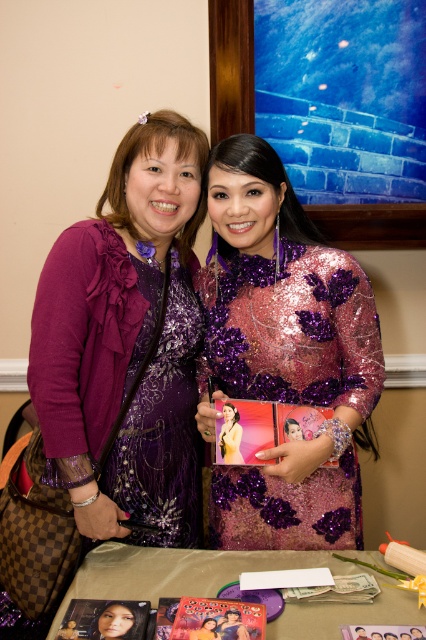
Question: Is purple sequined dress at center further to camera compared to metallic gold photo frame at center?

Choices:
 (A) yes
 (B) no

Answer: (A)

Question: Among these objects, which one is nearest to the camera?

Choices:
 (A) metallic gold table at lower center
 (B) sequined purple dress at center

Answer: (A)

Question: Which point is farther to the camera?

Choices:
 (A) metallic gold table at lower center
 (B) purple sequined dress at center

Answer: (B)

Question: Considering the real-world distances, which object is closest to the sparkly purple dress at center?

Choices:
 (A) sequined purple dress at center
 (B) purple sequined dress at center

Answer: (A)

Question: Does metallic gold table at lower center come in front of metallic gold photo frame at center?

Choices:
 (A) yes
 (B) no

Answer: (B)

Question: Does sequined purple dress at center appear under metallic gold photo frame at center?

Choices:
 (A) yes
 (B) no

Answer: (B)